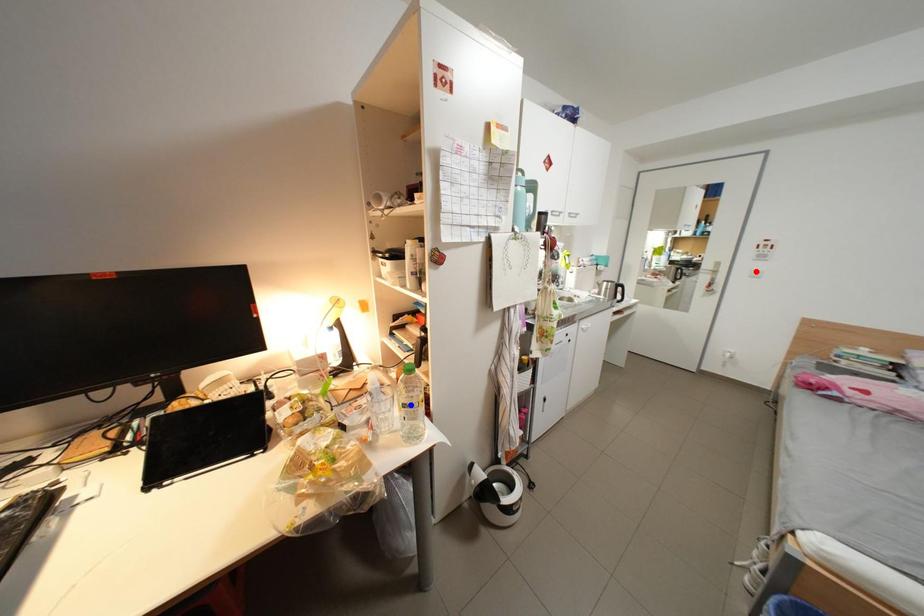
Question: In the image, two points are highlighted. Which point is nearer to the camera? Reply with the corresponding letter.

Choices:
 (A) blue point
 (B) red point

Answer: (A)